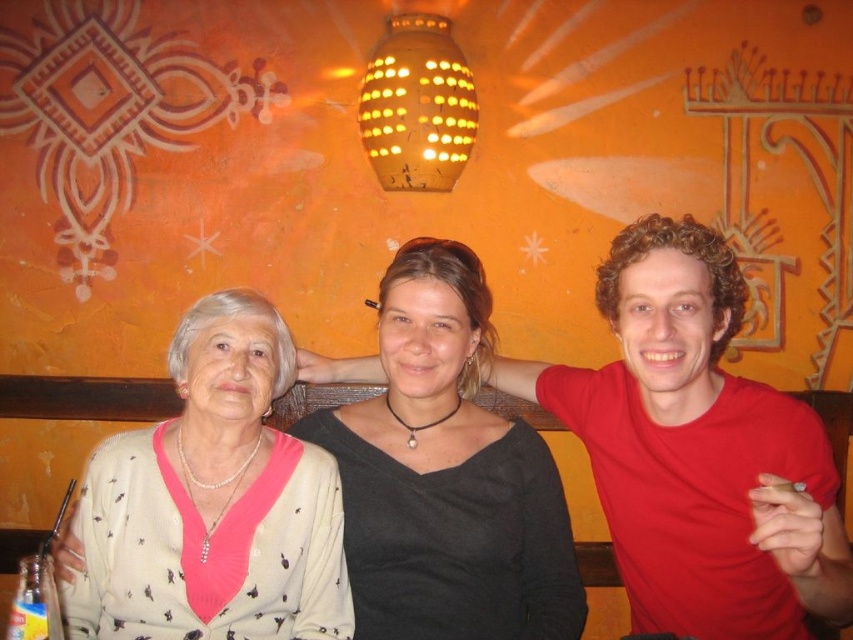
Question: Among these points, which one is farthest from the camera?

Choices:
 (A) (244, 316)
 (B) (398, 529)
 (C) (627, 460)

Answer: (C)

Question: Which point appears closest to the camera in this image?

Choices:
 (A) (281, 460)
 (B) (422, 557)

Answer: (B)

Question: Which object is closer to the camera taking this photo?

Choices:
 (A) black matte shirt at center
 (B) pearl necklace at center
 (C) red matte shirt at center

Answer: (C)

Question: Can you confirm if red matte shirt at center is wider than pearl necklace at center?

Choices:
 (A) yes
 (B) no

Answer: (A)

Question: Can you confirm if black matte shirt at center is thinner than pearl necklace at center?

Choices:
 (A) no
 (B) yes

Answer: (A)

Question: Does red matte shirt at center come in front of black matte shirt at center?

Choices:
 (A) yes
 (B) no

Answer: (A)